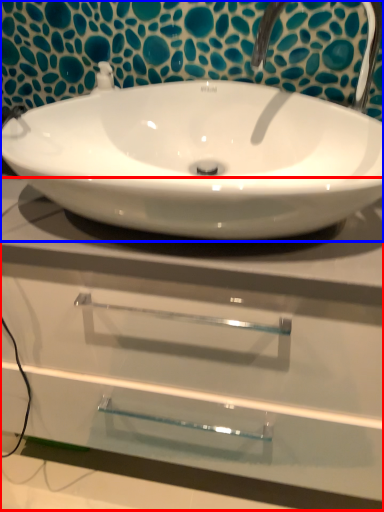
Question: Among these objects, which one is farthest to the camera, counter top (highlighted by a red box) or sink (highlighted by a blue box)?

Choices:
 (A) counter top
 (B) sink

Answer: (A)